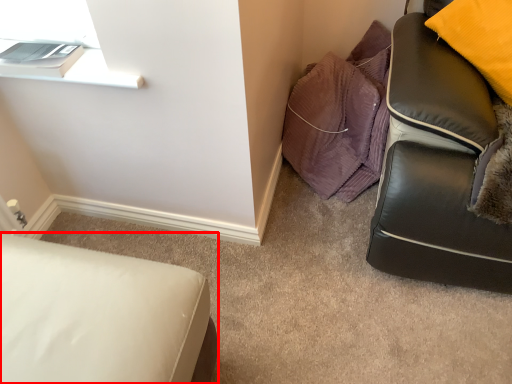
Question: From the image's perspective, where is furniture (annotated by the red box) located in relation to material in the image?

Choices:
 (A) below
 (B) above

Answer: (A)